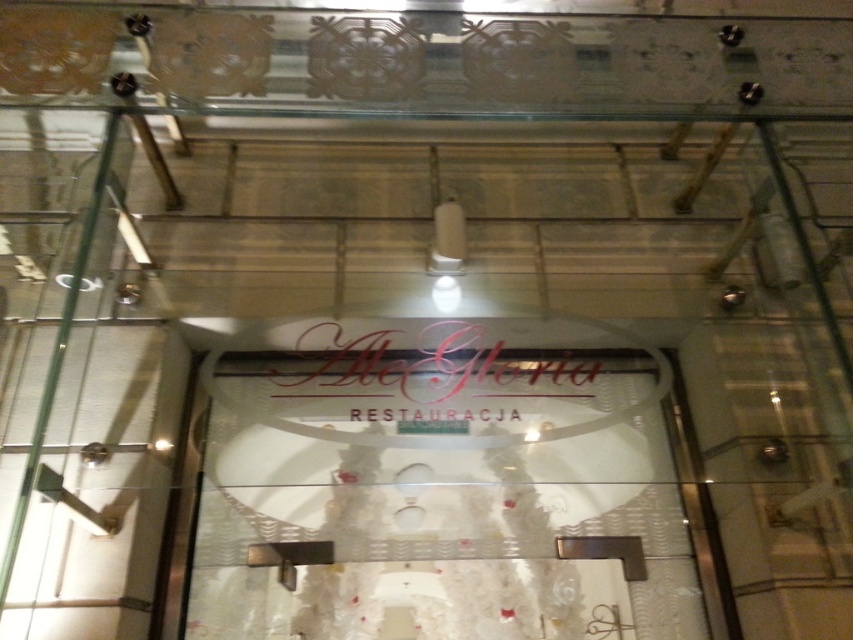
You are a delivery person trying to place a new menu board between the transparent glass signboard at center and the matte gold sign at center. The menu board is 10 centimeters wide. Can you fit it between them without overlapping?

The transparent glass signboard at center is 9.14 centimeters from matte gold sign at center. Since the menu board is 10 centimeters wide, which is wider than the gap between them, it cannot be placed between them without overlapping.

You are standing in front of the restaurant entrance and want to read both the transparent glass signboard at center and the matte gold sign at center. Which one do you need to look to the left of first?

The transparent glass signboard at center is to the right of the matte gold sign at center, so you should look to the left first at the matte gold sign at center.